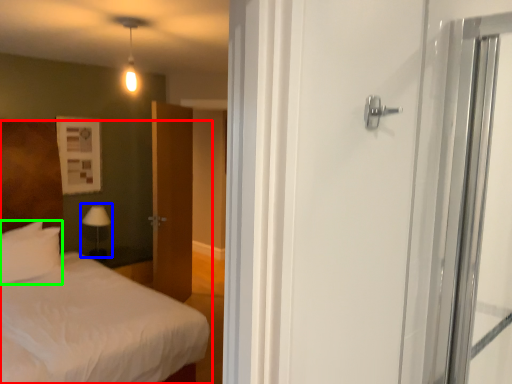
Question: Estimate the real-world distances between objects in this image. Which object is closer to bed (highlighted by a red box), table lamp (highlighted by a blue box) or pillow (highlighted by a green box)?

Choices:
 (A) table lamp
 (B) pillow

Answer: (B)